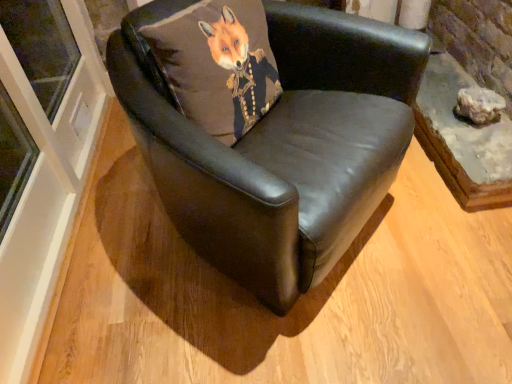
This screenshot has width=512, height=384. What are the coordinates of `free spot to the left of black leather chair at center` in the screenshot? It's located at (111, 247).